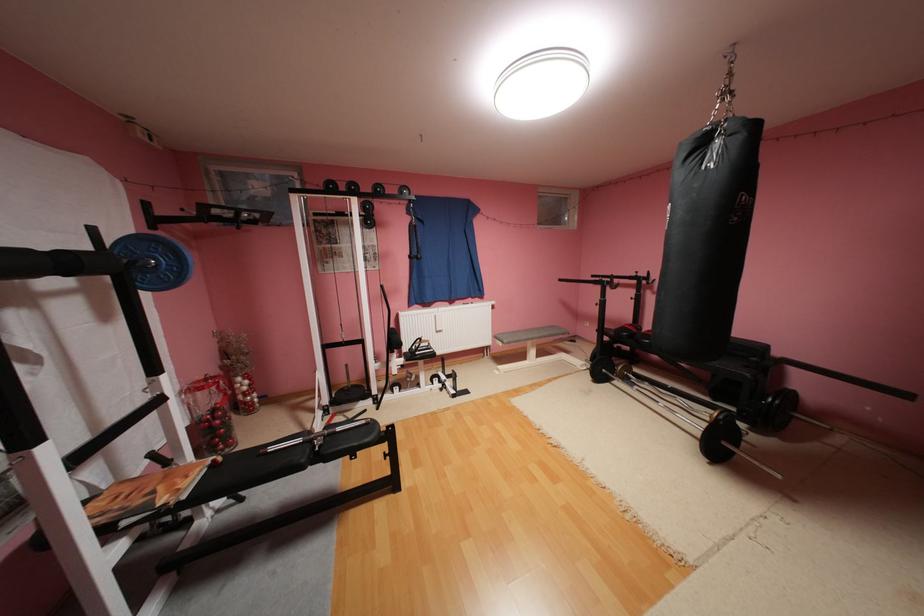
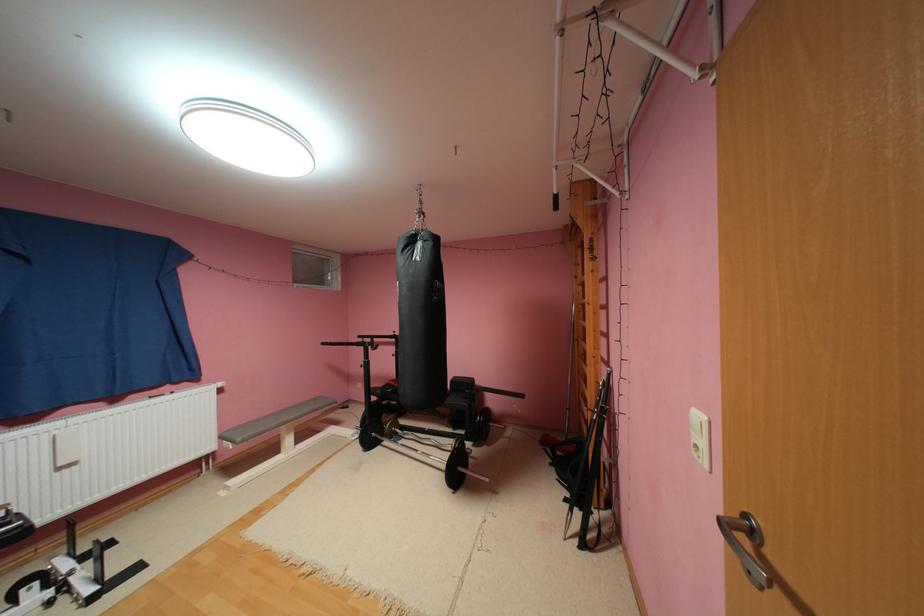
Question: The first image is from the beginning of the video and the second image is from the end. How did the camera likely rotate when shooting the video?

Choices:
 (A) Left
 (B) Right
 (C) Up
 (D) Down

Answer: (B)